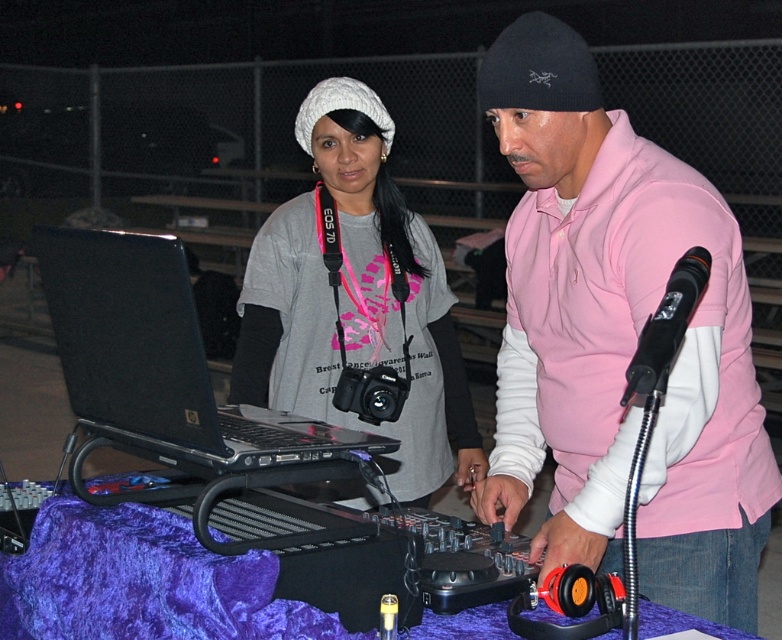
You are standing at the center of the DJ table and want to place a new microphone on the table. The microphone requires a space of 0.1 units in width. Can you place it at point [160,358] without overlapping with the black plastic laptop at left?

The point [160,358] is occupied by the black plastic laptop at left, so you cannot place the microphone there without overlapping.

You are standing at the DJ table in the foreground of the scene. You need to locate the pink matte shirt at center. According to the coordinates provided, where should you look relative to your position?

The pink matte shirt at center is located at coordinates point (619, 340), which means it is positioned slightly to the right and lower from the center of the scene.